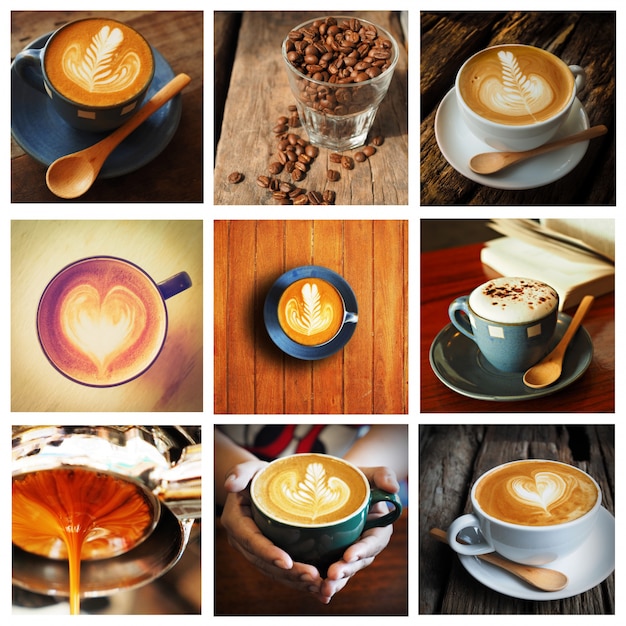
Identify the location of saucers. (47, 133), (459, 133), (473, 372), (588, 563), (285, 346), (146, 558).